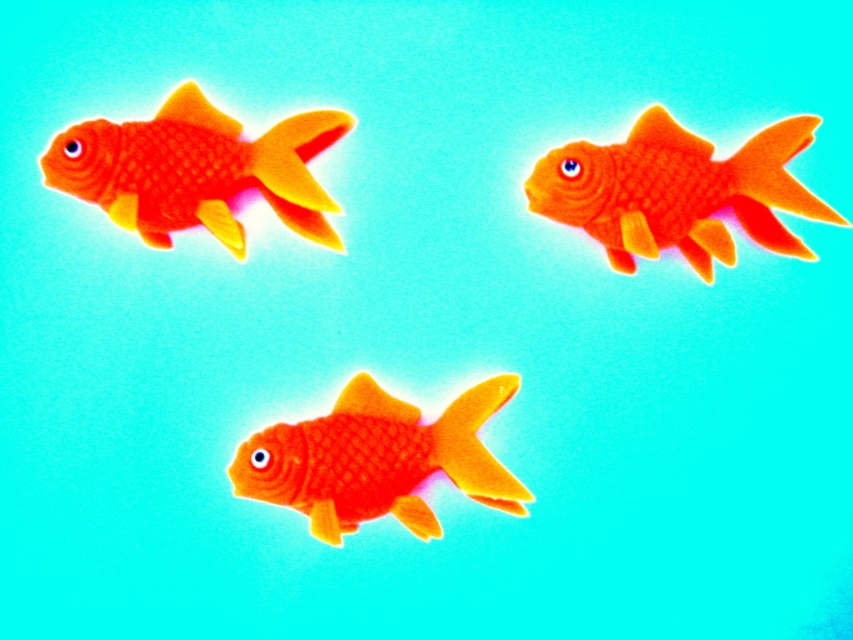
You are an aquarium keeper trying to place two matte orange goldfish into a small tank. The tank has a width of 10 cm. You have the matte orange goldfish at upper right and the matte orange goldfish at upper left. Which goldfish can fit in the tank if the tank can only accommodate the narrower of the two?

The matte orange goldfish at upper left can fit in the tank since it is narrower than the matte orange goldfish at upper right.

You are an aquarium designer and need to place two goldfish in a small tank. The tank has limited space. Based on the image, which of the two goldfish, the matte orange goldfish at upper left or the matte orange goldfish at center, would require more space due to its size?

The matte orange goldfish at upper left requires more space because its width is larger than the matte orange goldfish at center.

From the picture: You are an aquarium owner who wants to place two goldfish in a small tank. You have the matte orange goldfish at upper right and the matte orange goldfish at upper left. Which goldfish requires more space in the tank?

The matte orange goldfish at upper left requires more space in the tank because it is larger than the matte orange goldfish at upper right.